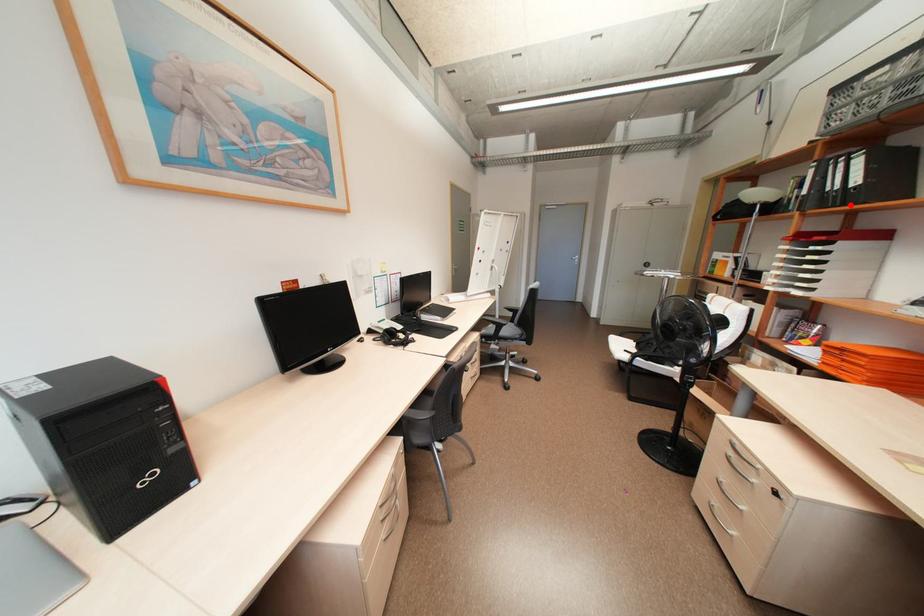
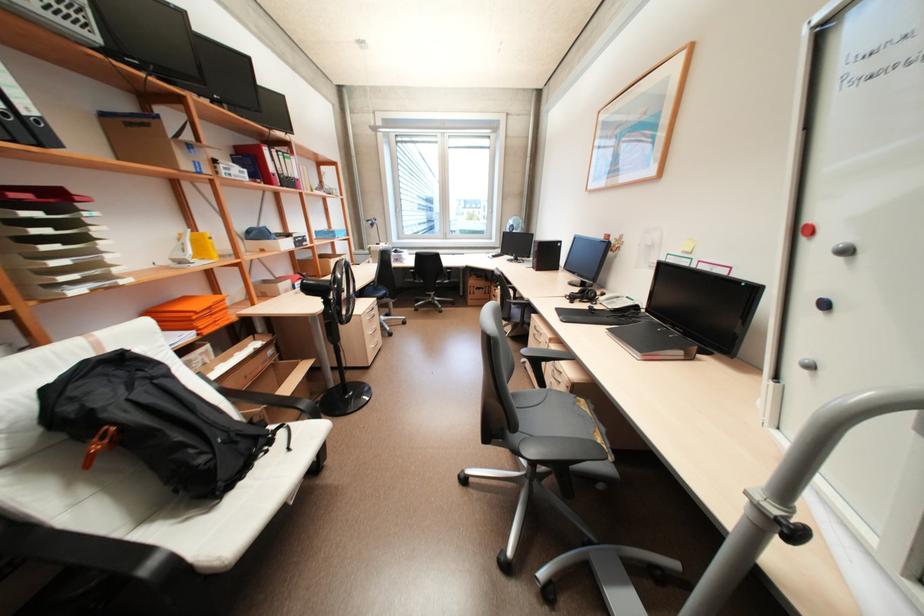
Find the pixel in the second image that matches the highlighted location in the first image.

(46, 146)